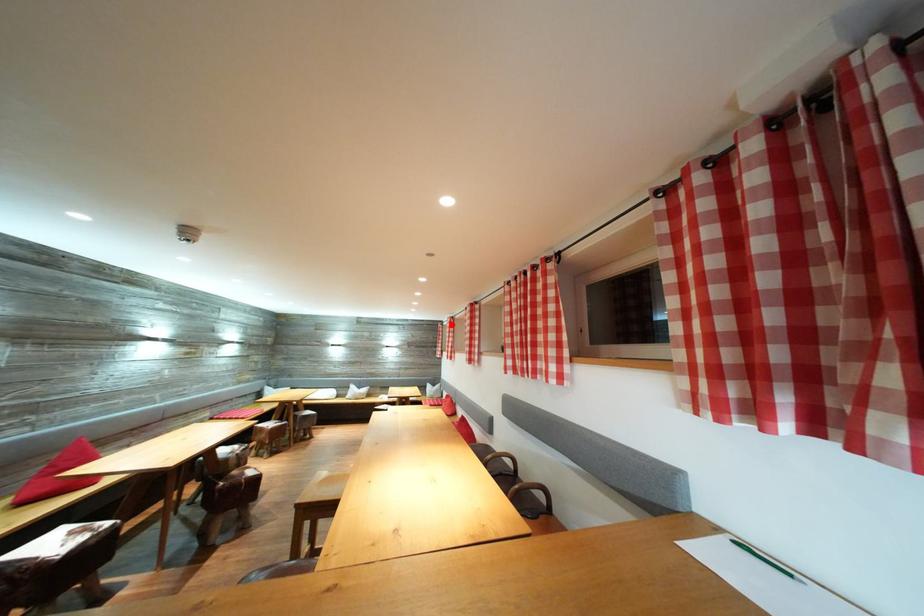
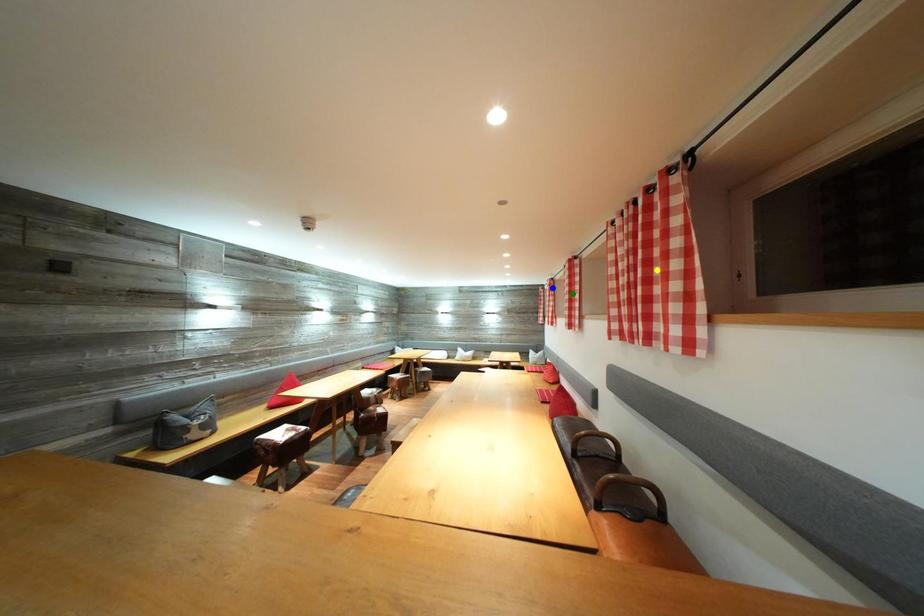
Question: I am providing you with two images of the same scene from different viewpoints. A red point is marked on the first image. You are given multiple points on the second image. Which point in image 2 is actually the same real-world point as the red point in image 1?

Choices:
 (A) blue point
 (B) yellow point
 (C) green point

Answer: (A)